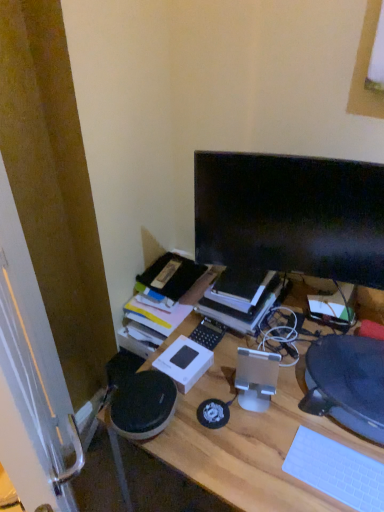
Locate an element on the screen. The width and height of the screenshot is (384, 512). unoccupied space behind white matte keyboard at lower right is located at coordinates (317, 420).